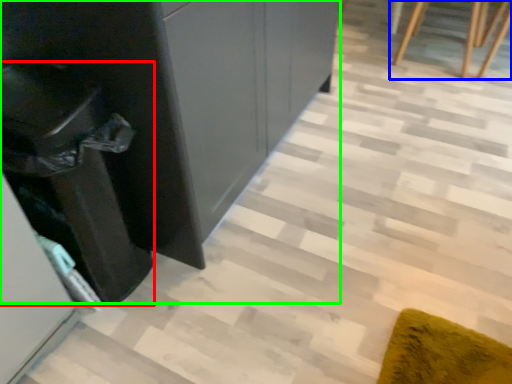
Question: Which object is the closest to the cabinetry (highlighted by a red box)? Choose among these: furniture (highlighted by a blue box) or dresser (highlighted by a green box).

Choices:
 (A) furniture
 (B) dresser

Answer: (B)